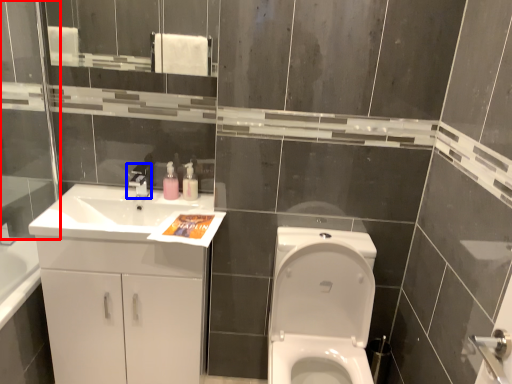
Question: Which object appears farthest to the camera in this image, glass door (highlighted by a red box) or tap (highlighted by a blue box)?

Choices:
 (A) glass door
 (B) tap

Answer: (B)